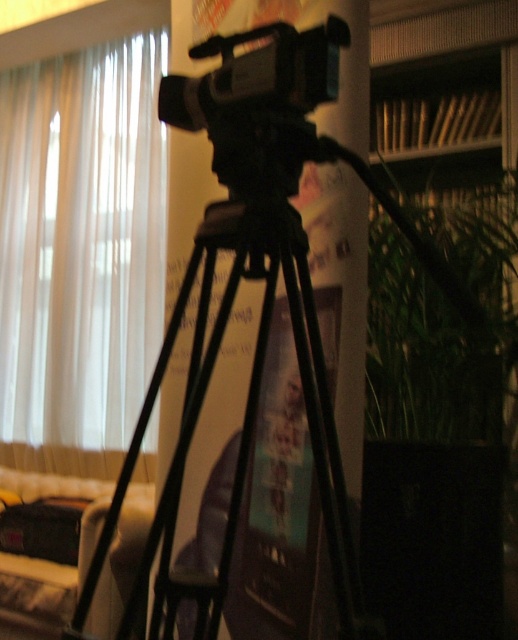
You are setting up a video call and need to ensure that both the black matte tripod at center and the green leafy plant at right are visible in the frame. Based on their heights, which object will appear larger in the camera view?

The black matte tripod at center is much taller than the green leafy plant at right, so it will appear larger in the camera view.

You are setting up a video call and need to ensure that both the green leafy plant at right and the black plastic camera at center are within the frame. The camera has a 90 degree field of view. Can you confirm if both objects will be visible in the camera feed?

The green leafy plant at right and black plastic camera at center are 1.13 meters apart from each other. Since the camera has a 90 degree field of view, which is wide enough to capture objects at this distance apart, both objects will be visible in the camera feed.

You are standing in the living room where the camera is set up. There are two points marked in the image. The first point is at coordinates point (23, 337) and the second point is at point (260, 77). Which point is closer to you?

Point (23, 337) is further to the viewer than point (260, 77), so the point closer to you is point (260, 77).